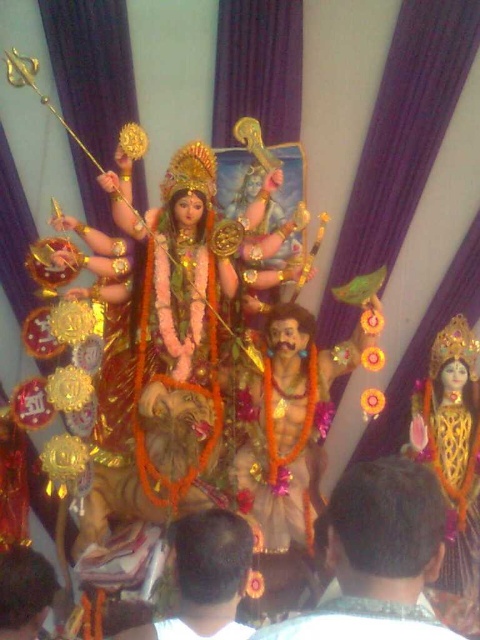
Is brown textured hair at center wider than brown hair at lower center?

Yes, brown textured hair at center is wider than brown hair at lower center.

Between brown textured hair at center and brown hair at lower center, which one has more height?

brown textured hair at center is taller.

What do you see at coordinates (379, 556) in the screenshot?
I see `brown textured hair at center` at bounding box center [379, 556].

Find the location of `brown textured hair at center`. brown textured hair at center is located at coordinates (379, 556).

Is brown textured hair at center positioned at the back of dark brown hair at lower left?

No, brown textured hair at center is in front of dark brown hair at lower left.

Does brown textured hair at center have a smaller size compared to dark brown hair at lower left?

Actually, brown textured hair at center might be larger than dark brown hair at lower left.

Find the location of `brown textured hair at center`. brown textured hair at center is located at coordinates (379, 556).

I want to click on brown hair at lower center, so click(205, 579).

Find the location of a particular element. brown hair at lower center is located at coordinates (205, 579).